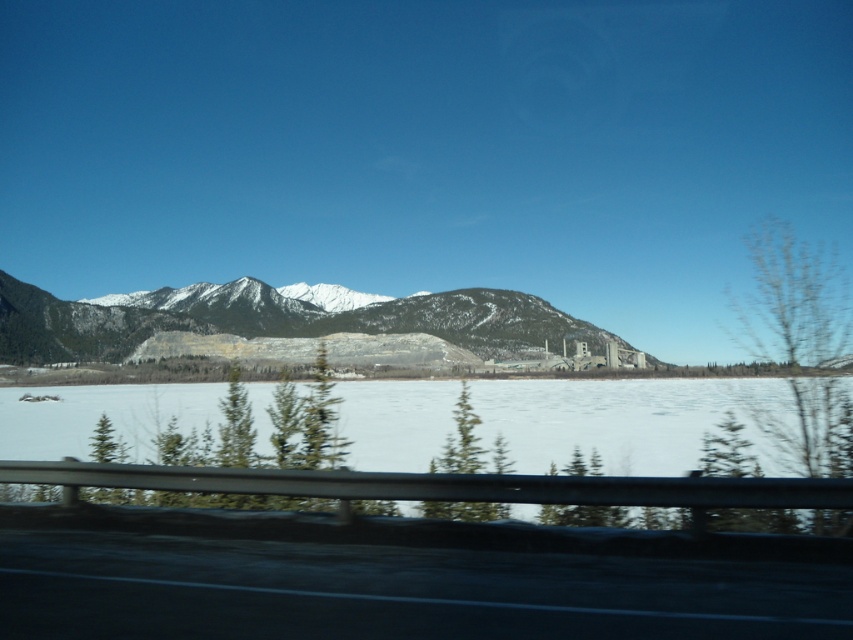
Is black asphalt highway at lower center to the left of snowy rock mountain at center from the viewer's perspective?

Incorrect, black asphalt highway at lower center is not on the left side of snowy rock mountain at center.

The image size is (853, 640). What do you see at coordinates (398, 589) in the screenshot? I see `black asphalt highway at lower center` at bounding box center [398, 589].

This screenshot has width=853, height=640. I want to click on black asphalt highway at lower center, so click(x=398, y=589).

Between point (604, 636) and point (703, 506), which one is positioned behind?

The point (703, 506) is more distant.

Locate an element on the screen. The height and width of the screenshot is (640, 853). black asphalt highway at lower center is located at coordinates (x=398, y=589).

Can you confirm if white ice at center is thinner than snowy rock mountain at center?

Yes, white ice at center is thinner than snowy rock mountain at center.

Does point (79, 476) lie behind point (146, 316)?

No, it is in front of (146, 316).

Is point (715, 384) in front of point (9, 360)?

Yes.

Find the location of a particular element. This screenshot has width=853, height=640. white ice at center is located at coordinates (461, 484).